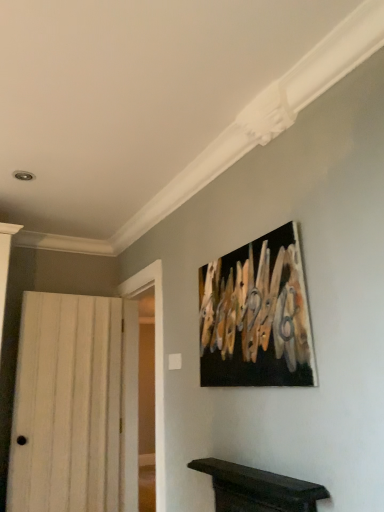
The width and height of the screenshot is (384, 512). What are the coordinates of `black canvas painting at upper center` in the screenshot? It's located at (257, 315).

What do you see at coordinates (257, 315) in the screenshot? This screenshot has height=512, width=384. I see `black canvas painting at upper center` at bounding box center [257, 315].

What do you see at coordinates (75, 406) in the screenshot? I see `white wood door at left` at bounding box center [75, 406].

Image resolution: width=384 pixels, height=512 pixels. I want to click on white wood door at left, so click(x=75, y=406).

Where is `black canvas painting at upper center`? The width and height of the screenshot is (384, 512). black canvas painting at upper center is located at coordinates (257, 315).

Between white wood door at left and black canvas painting at upper center, which one appears on the left side from the viewer's perspective?

white wood door at left is more to the left.

Which object is closer to the camera, white wood door at left or black canvas painting at upper center?

black canvas painting at upper center is in front.

Which is behind, point (14, 484) or point (215, 316)?

The point (14, 484) is farther.

From the image's perspective, does white wood door at left appear lower than black canvas painting at upper center?

Yes.

From a real-world perspective, is white wood door at left physically above black canvas painting at upper center?

Actually, white wood door at left is physically below black canvas painting at upper center in the real world.

Which of these two, white wood door at left or black canvas painting at upper center, is wider?

white wood door at left is wider.

Considering the sizes of objects white wood door at left and black canvas painting at upper center in the image provided, who is taller, white wood door at left or black canvas painting at upper center?

white wood door at left.

Is white wood door at left bigger or smaller than black canvas painting at upper center?

Clearly, white wood door at left is larger in size than black canvas painting at upper center.

Is white wood door at left spatially inside black canvas painting at upper center, or outside of it?

white wood door at left is spatially situated outside black canvas painting at upper center.

Is white wood door at left directly adjacent to black canvas painting at upper center?

No, white wood door at left is not with black canvas painting at upper center.

Consider the image. Is white wood door at left positioned with its back to black canvas painting at upper center?

No, black canvas painting at upper center is not at the back of white wood door at left.

Can you tell me how much white wood door at left and black canvas painting at upper center differ in facing direction?

The angle between the facing direction of white wood door at left and the facing direction of black canvas painting at upper center is 94.6 degrees.

How distant is white wood door at left from black canvas painting at upper center?

white wood door at left is 1.64 meters away from black canvas painting at upper center.

The image size is (384, 512). In order to click on door behind the black canvas painting at upper center in this screenshot , I will do `click(75, 406)`.

Which object is positioned more to the left, black canvas painting at upper center or white wood door at left?

white wood door at left.

Between black canvas painting at upper center and white wood door at left, which one is positioned in front?

Positioned in front is black canvas painting at upper center.

From the picture: Which is further, (222, 365) or (49, 388)?

The point (49, 388) is behind.

From the image's perspective, between black canvas painting at upper center and white wood door at left, which one is located above?

black canvas painting at upper center, from the image's perspective.

From a real-world perspective, who is located higher, black canvas painting at upper center or white wood door at left?

From a 3D spatial view, black canvas painting at upper center is above.

Between black canvas painting at upper center and white wood door at left, which one has larger width?

white wood door at left.

Considering the sizes of black canvas painting at upper center and white wood door at left in the image, is black canvas painting at upper center taller or shorter than white wood door at left?

Considering their sizes, black canvas painting at upper center has less height than white wood door at left.

Based on their sizes in the image, would you say black canvas painting at upper center is bigger or smaller than white wood door at left?

black canvas painting at upper center is smaller than white wood door at left.

Is black canvas painting at upper center positioned beyond the bounds of white wood door at left?

Indeed, black canvas painting at upper center is completely outside white wood door at left.

Is there a large distance between black canvas painting at upper center and white wood door at left?

That's right, there is a large distance between black canvas painting at upper center and white wood door at left.

Is black canvas painting at upper center looking in the opposite direction of white wood door at left?

That's not correct — black canvas painting at upper center is not looking away from white wood door at left.

How different are the orientations of black canvas painting at upper center and white wood door at left in degrees?

94.6 degrees.

Find the location of a particular element. Image resolution: width=384 pixels, height=512 pixels. picture frame above the white wood door at left (from a real-world perspective) is located at coordinates (257, 315).

Locate an element on the screen. door on the left of black canvas painting at upper center is located at coordinates (75, 406).

Where is `picture frame that appears in front of the white wood door at left`? Image resolution: width=384 pixels, height=512 pixels. picture frame that appears in front of the white wood door at left is located at coordinates tap(257, 315).